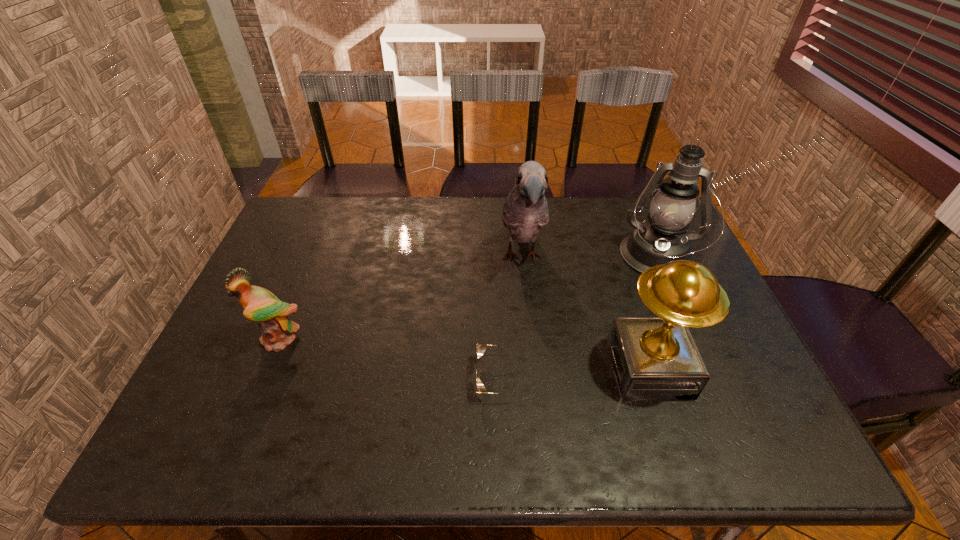
I want to click on award present at the right edge, so click(x=654, y=357).

Locate an element on the screen. object that is at the far right corner is located at coordinates (662, 239).

Where is `vacant space at the far edge of the desktop`? Image resolution: width=960 pixels, height=540 pixels. vacant space at the far edge of the desktop is located at coordinates (612, 199).

Locate an element on the screen. vacant space at the near edge is located at coordinates (510, 455).

In the image, there is a desktop. Identify the location of vacant space at the left edge. Image resolution: width=960 pixels, height=540 pixels. (232, 331).

At what (x,y) coordinates should I click in order to perform the action: click on vacant space at the right edge of the desktop. Please return your answer as a coordinate pair (x, y). Looking at the image, I should click on (759, 417).

The height and width of the screenshot is (540, 960). What are the coordinates of `blank space at the near right corner of the desktop` in the screenshot? It's located at (728, 436).

The height and width of the screenshot is (540, 960). I want to click on blank region between the leftmost object and the shortest object, so click(x=390, y=359).

The width and height of the screenshot is (960, 540). Find the location of `unoccupied position between the oil lamp and the shortest object`. unoccupied position between the oil lamp and the shortest object is located at coordinates (578, 319).

Locate an element on the screen. vacant point located between the award and the nearer parrot is located at coordinates (465, 354).